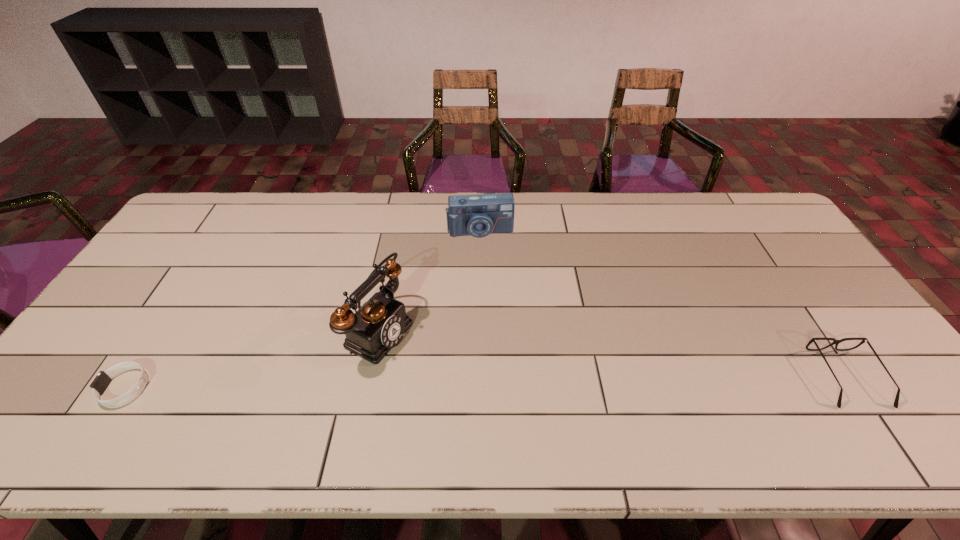
Find the location of a particular element. object located in the left edge section of the desktop is located at coordinates (103, 379).

Identify the location of object that is at the right edge. (836, 342).

At what (x,y) coordinates should I click in order to perform the action: click on object positioned at the near left corner. Please return your answer as a coordinate pair (x, y). The height and width of the screenshot is (540, 960). Looking at the image, I should click on (103, 379).

Image resolution: width=960 pixels, height=540 pixels. I want to click on object that is positioned at the near right corner, so click(x=836, y=342).

The height and width of the screenshot is (540, 960). I want to click on free space at the far edge of the desktop, so click(x=725, y=225).

Find the location of a particular element. This screenshot has width=960, height=540. vacant area at the near edge is located at coordinates (708, 389).

Image resolution: width=960 pixels, height=540 pixels. I want to click on blank area at the left edge, so click(x=122, y=341).

In the image, there is a desktop. At what (x,y) coordinates should I click in order to perform the action: click on free space at the right edge. Please return your answer as a coordinate pair (x, y). Looking at the image, I should click on (838, 305).

The height and width of the screenshot is (540, 960). In order to click on blank region between the third object from left to right and the second shortest object in this screenshot , I will do `click(663, 305)`.

Where is `vacant region between the second object from left to right and the shortest object`? Image resolution: width=960 pixels, height=540 pixels. vacant region between the second object from left to right and the shortest object is located at coordinates (252, 359).